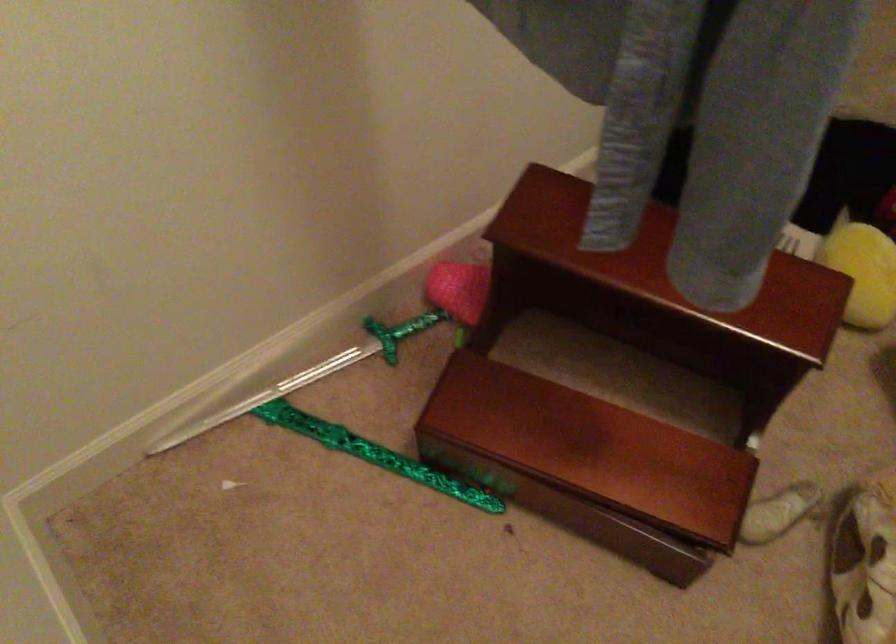
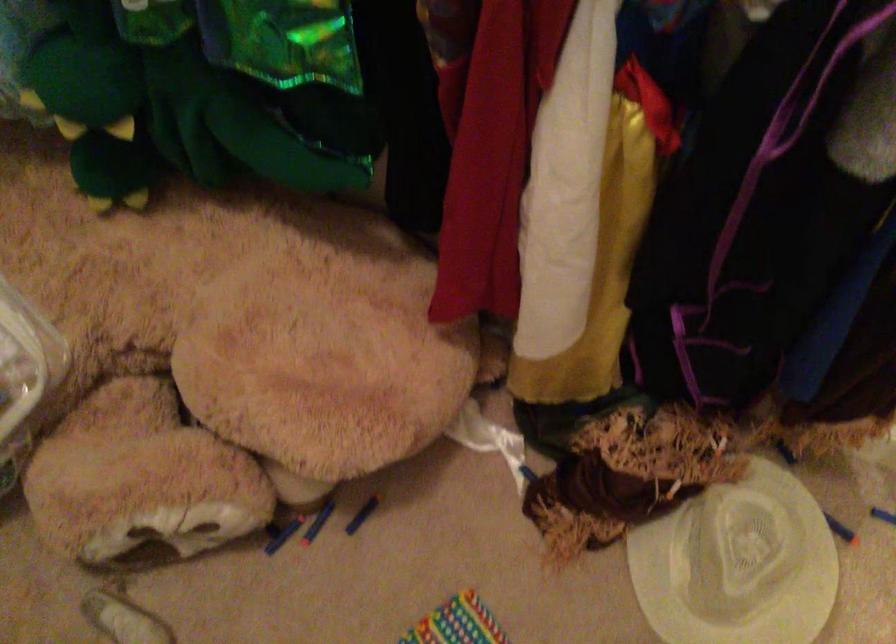
Based on the continuous images, in which direction is the camera rotating?

The camera's rotation is toward right-down.